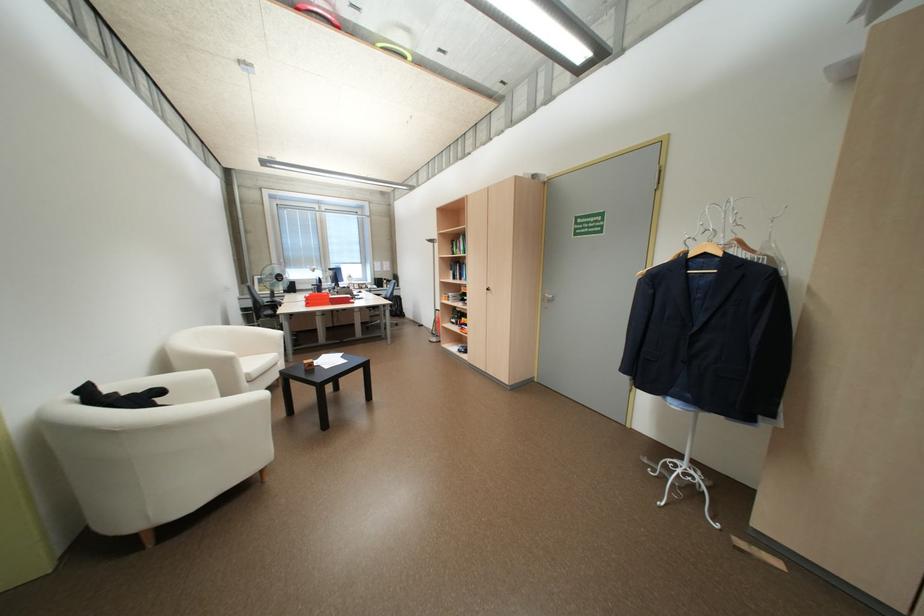
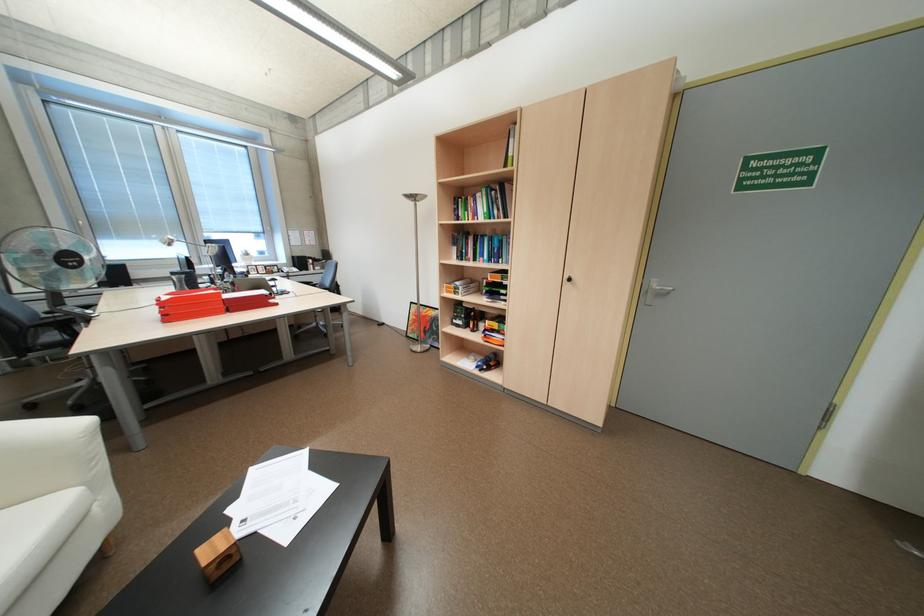
Where in the second image is the point corresponding to the point at 315,361 from the first image?

(217, 551)